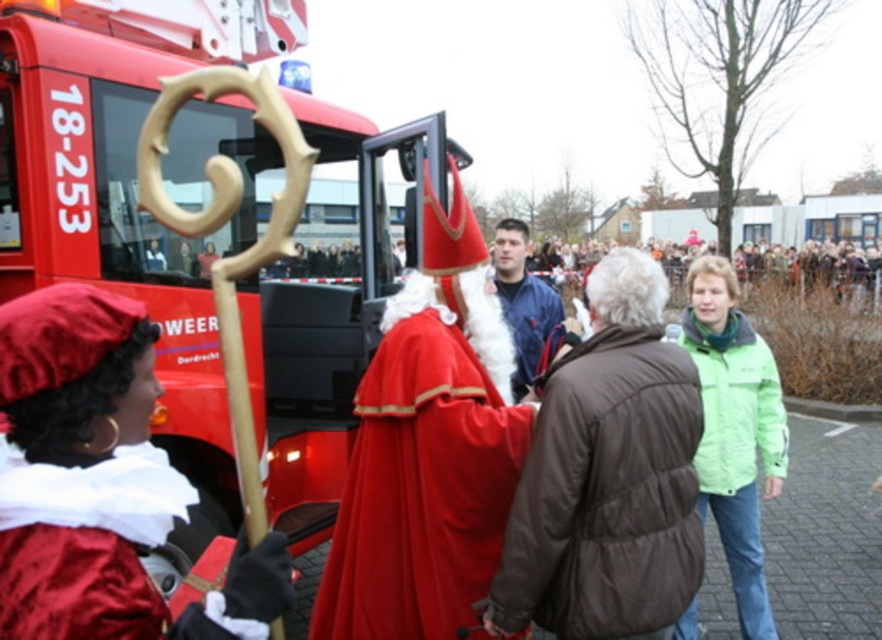
You are organizing a costume party and need to ensure that all costumes fit through the entrance door, which is 1.2 meters wide. You have two costumes to check from the image description. The velvet red robe at center and the velvet red cape at center. Which costume is wider and will require more space to move through the door?

The velvet red robe at center is wider than the velvet red cape at center, so it will require more space to move through the door.

You are a photographer at the event and want to take a photo of the velvet red cape at center and brown puffy jacket at center. Which object should you focus on first to ensure both are in focus without moving the camera?

You should focus on the brown puffy jacket at center first since the velvet red cape at center is behind it. By focusing on the closer object, the jacket, the cape in the background will also be in focus if the depth of field is sufficient.